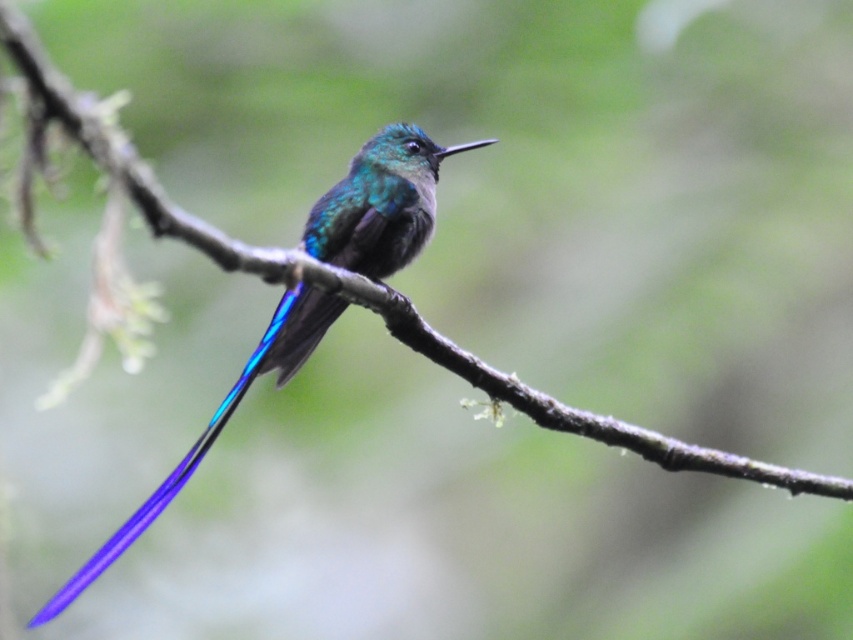
You are a birdwatcher observing the hummingbird. You notice the metallic iridescent hummingbird at center and the glossy blue tail at center. Which object is positioned higher in the image?

The metallic iridescent hummingbird at center is located above the glossy blue tail at center, so it is positioned higher in the image.

You are a photographer trying to capture the metallic iridescent hummingbird at center and the glossy blue tail at center in a single frame. Since the hummingbird is moving, you need to focus on the area where both are visible. Based on their positions, which object should you prioritize focusing on to ensure both are in the frame?

The metallic iridescent hummingbird at center is to the right of the glossy blue tail at center. Therefore, you should focus on the area where the hummingbird is located since it is positioned to the right of the tail, ensuring both are within the frame.